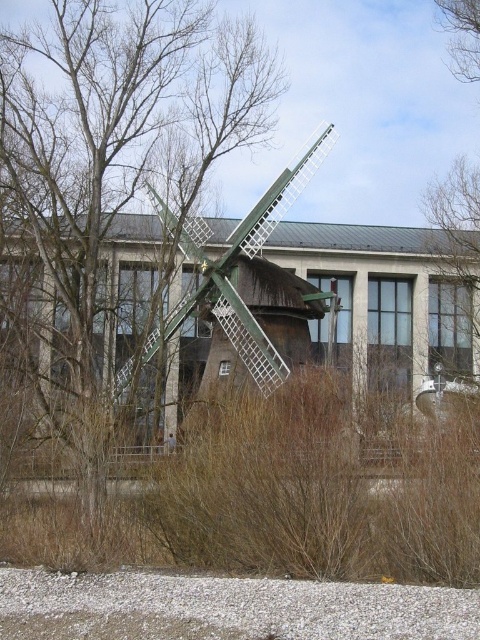
You are standing at the gravel path and want to take a photo of both the brown leafless tree at center and the green matte windmill at center. Which object should you position to your left to include both in the frame?

You should position the brown leafless tree at center to your left since it is already on the left side of the green matte windmill at center, allowing both to be captured in the photo frame.

You are a gardener planning to plant a new tree that requires at least 20 feet of space between it and the green matte windmill at center to avoid root interference. You want to plant it where the brown leafless tree at center currently stands. Is this location suitable?

The brown leafless tree at center and green matte windmill at center are 18.95 feet apart from each other. Since 18.95 feet is less than the required 20 feet, planting the new tree there would not meet the spacing requirement and could lead to root interference with the green matte windmill at center.

You are standing at the gravel path leading to the windmill. There are two points marked in the scene, point 1 at coordinates point [162,17] and point 2 at coordinates point [244,346]. Which point is closer to you?

Point [162,17] is closer to the camera than point [244,346], so the point closer to you is point [162,17].